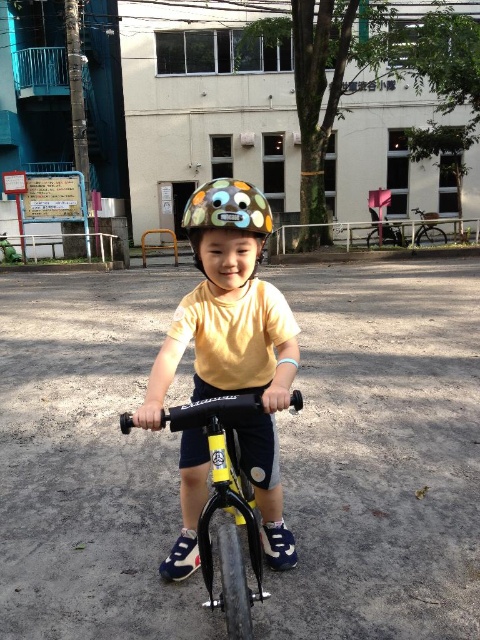
Does point (253, 304) come behind point (202, 532)?

Yes.

Can you confirm if yellow matte helmet at center is thinner than black matte bicycle at center?

No, yellow matte helmet at center is not thinner than black matte bicycle at center.

This screenshot has height=640, width=480. What do you see at coordinates (235, 339) in the screenshot?
I see `yellow matte helmet at center` at bounding box center [235, 339].

This screenshot has width=480, height=640. In order to click on yellow matte helmet at center in this screenshot , I will do `click(235, 339)`.

Who is higher up, yellow matte helmet at center or metallic silver bicycle at right?

Positioned higher is metallic silver bicycle at right.

Does point (257, 483) come behind point (432, 237)?

No, (257, 483) is closer to viewer.

Identify the location of yellow matte helmet at center. This screenshot has height=640, width=480. (235, 339).

Who is higher up, black matte bicycle at center or metallic silver bicycle at right?

metallic silver bicycle at right

Does black matte bicycle at center have a greater width compared to metallic silver bicycle at right?

No.

Locate an element on the screen. This screenshot has width=480, height=640. black matte bicycle at center is located at coordinates (226, 508).